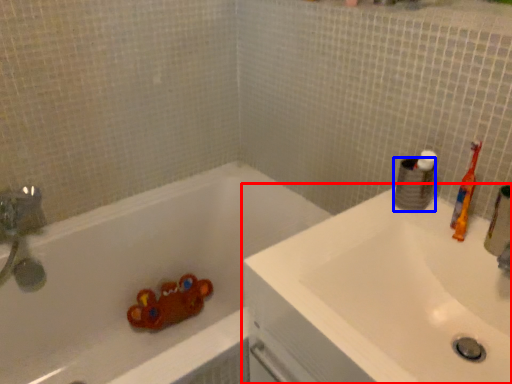
Question: Which of the following is the farthest to the observer, sink (highlighted by a red box) or toilet paper (highlighted by a blue box)?

Choices:
 (A) sink
 (B) toilet paper

Answer: (B)